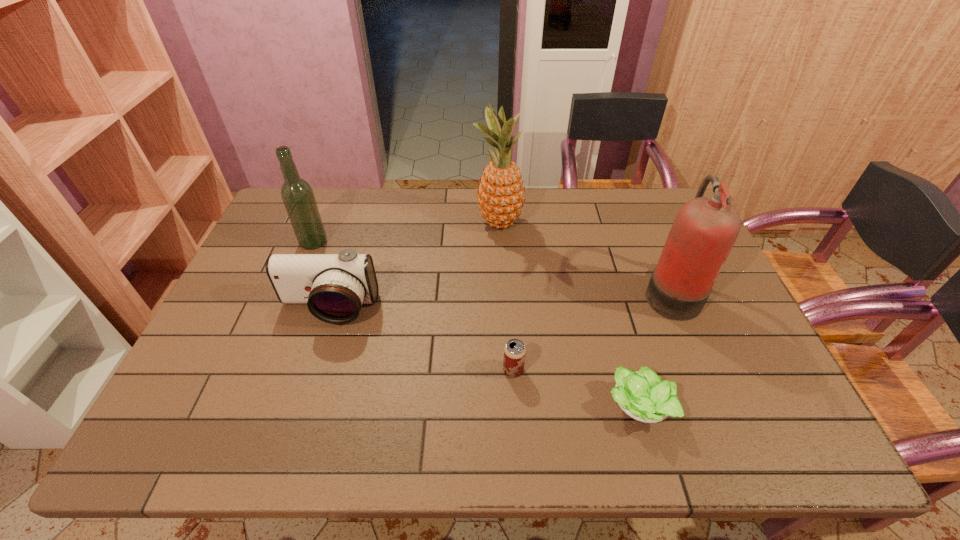
You are a GUI agent. You are given a task and a screenshot of the screen. Output one action in this format:
    pyautogui.click(x=<x>, y=<y>)
    Task: Click on the object that is at the right edge
    
    Given the screenshot: What is the action you would take?
    pyautogui.click(x=705, y=229)

Locate an element on the screen. vacant region at the far edge is located at coordinates (605, 220).

Where is `vacant space at the right edge`? Image resolution: width=960 pixels, height=540 pixels. vacant space at the right edge is located at coordinates (713, 319).

Where is `free space at the near left corner of the desktop`? This screenshot has width=960, height=540. free space at the near left corner of the desktop is located at coordinates (209, 455).

You are a GUI agent. You are given a task and a screenshot of the screen. Output one action in this format:
    pyautogui.click(x=<x>, y=<y>)
    Task: Click on the vacant space at the far right corner of the desktop
    
    Given the screenshot: What is the action you would take?
    pyautogui.click(x=662, y=218)

Locate an element on the screen. free space between the nearest object and the beer can is located at coordinates click(575, 389).

Image resolution: width=960 pixels, height=540 pixels. I want to click on free point between the lettuce and the beer can, so click(575, 389).

Locate an element on the screen. This screenshot has width=960, height=540. vacant area that lies between the shortest object and the fire extinguisher is located at coordinates point(654,349).

Find the location of a particular element. This screenshot has height=540, width=960. free spot between the fifth tallest object and the liquor is located at coordinates (414, 306).

This screenshot has height=540, width=960. In order to click on free spot between the lettuce and the fire extinguisher in this screenshot , I will do `click(654, 349)`.